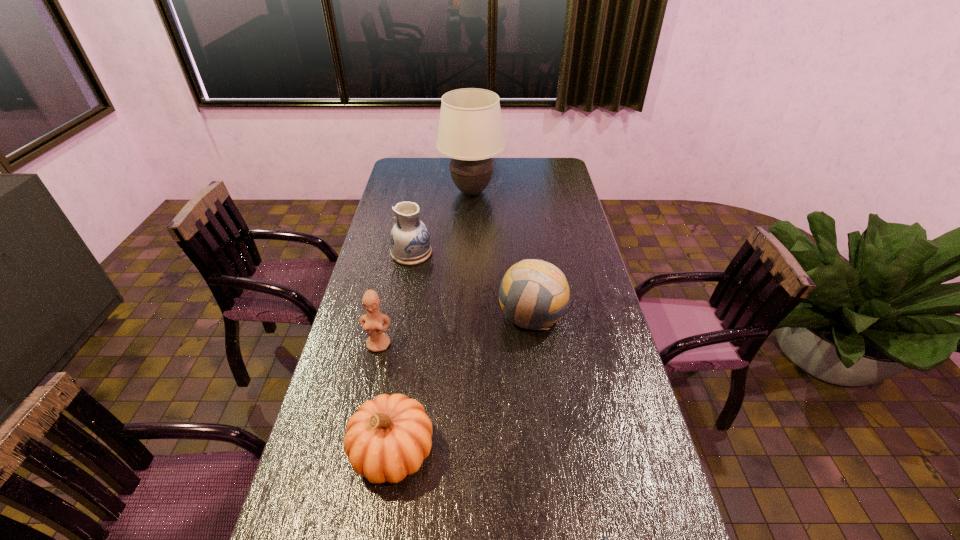
Where is `free space located on the back of the fifth farthest object`? The height and width of the screenshot is (540, 960). free space located on the back of the fifth farthest object is located at coordinates (413, 324).

The image size is (960, 540). I want to click on object present at the far edge, so click(470, 132).

Locate an element on the screen. The height and width of the screenshot is (540, 960). pottery situated at the left edge is located at coordinates (410, 241).

Locate an element on the screen. The height and width of the screenshot is (540, 960). figurine that is at the left edge is located at coordinates (372, 322).

At what (x,y) coordinates should I click in order to perform the action: click on pumpkin located at the left edge. Please return your answer as a coordinate pair (x, y). Looking at the image, I should click on (388, 438).

Image resolution: width=960 pixels, height=540 pixels. Find the location of `object located in the right edge section of the desktop`. object located in the right edge section of the desktop is located at coordinates (534, 294).

The height and width of the screenshot is (540, 960). What are the coordinates of `vacant region at the far edge of the desktop` in the screenshot? It's located at (426, 179).

Locate an element on the screen. This screenshot has width=960, height=540. free point at the right edge is located at coordinates (563, 255).

In the image, there is a desktop. What are the coordinates of `vacant space at the far right corner` in the screenshot? It's located at (538, 178).

Locate an element on the screen. The image size is (960, 540). empty space that is in between the fifth nearest object and the volleyball is located at coordinates (471, 284).